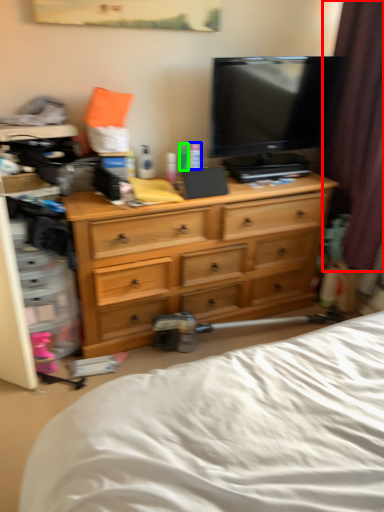
Question: Estimate the real-world distances between objects in this image. Which object is farther from curtain (highlighted by a red box), toiletry (highlighted by a blue box) or toiletry (highlighted by a green box)?

Choices:
 (A) toiletry
 (B) toiletry

Answer: (B)